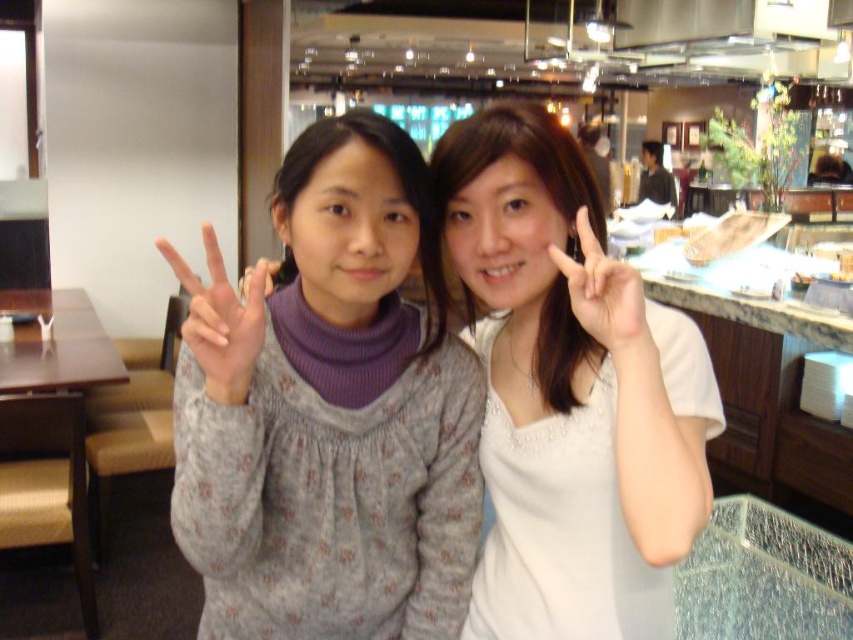
Question: Which point is closer to the camera?

Choices:
 (A) (602, 320)
 (B) (247, 394)
 (C) (222, 384)
 (D) (509, 451)

Answer: (C)

Question: Is gray floral sweater at center below gray textured sweater at center?

Choices:
 (A) no
 (B) yes

Answer: (B)

Question: Is gray textured sweater at center above white matte hand at center?

Choices:
 (A) no
 (B) yes

Answer: (A)

Question: Which object is farther from the camera taking this photo?

Choices:
 (A) gray floral sweater at center
 (B) white satin dress at center
 (C) white matte hand at center
 (D) gray textured sweater at center

Answer: (C)

Question: Is gray floral sweater at center behind white matte hand at center?

Choices:
 (A) yes
 (B) no

Answer: (B)

Question: Which of these objects is positioned closest to the gray textured sweater at center?

Choices:
 (A) white matte hand at center
 (B) white satin dress at center

Answer: (A)